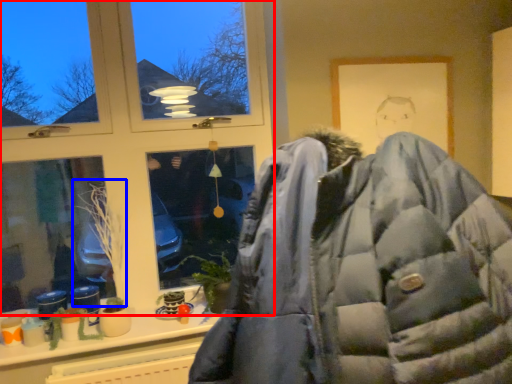
Question: Which object is closer to the camera taking this photo, window (highlighted by a red box) or plant (highlighted by a blue box)?

Choices:
 (A) window
 (B) plant

Answer: (A)